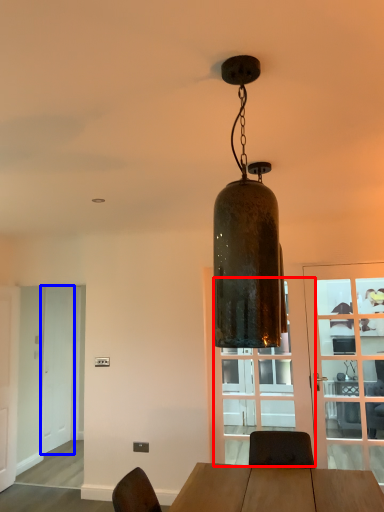
Question: Which point is further to the camera, glass door (highlighted by a red box) or screen door (highlighted by a blue box)?

Choices:
 (A) glass door
 (B) screen door

Answer: (B)